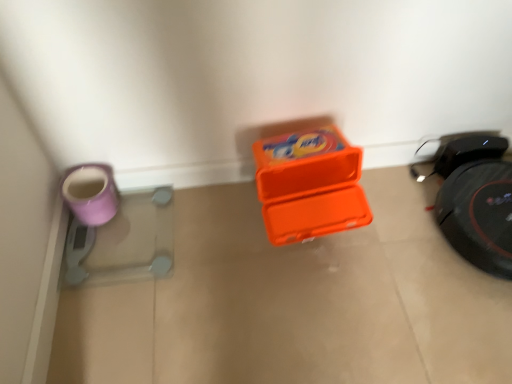
Where is `empty space that is ontop of orange plastic container at center (from a real-world perspective)`? This screenshot has width=512, height=384. empty space that is ontop of orange plastic container at center (from a real-world perspective) is located at coordinates (287, 284).